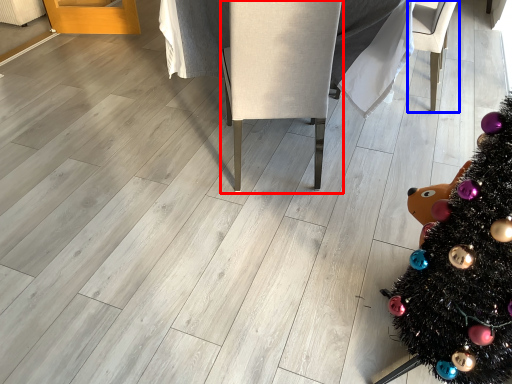
Question: Which of the following is the closest to the observer, armchair (highlighted by a red box) or armchair (highlighted by a blue box)?

Choices:
 (A) armchair
 (B) armchair

Answer: (A)